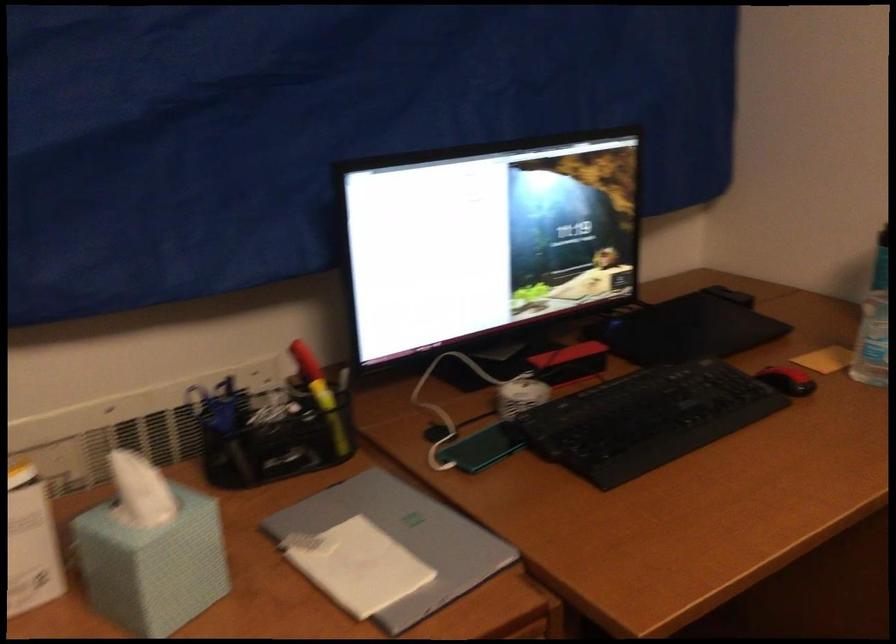
Where would you grasp the white computer mouse? Please return your answer as a coordinate pair (x, y).

(787, 380)